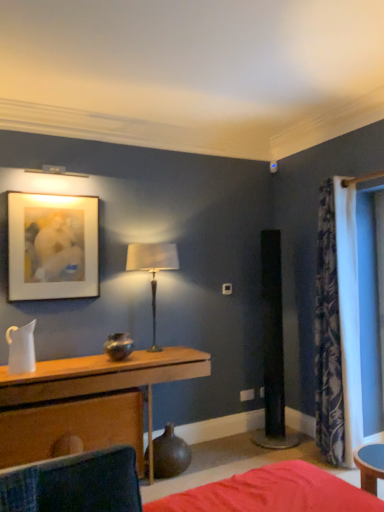
The width and height of the screenshot is (384, 512). Describe the element at coordinates (170, 454) in the screenshot. I see `matte brown vase at lower center` at that location.

Describe the element at coordinates (338, 322) in the screenshot. I see `floral fabric curtain at right` at that location.

What is the approximate height of metallic silver table lamp at center?

metallic silver table lamp at center is 91.65 centimeters tall.

The width and height of the screenshot is (384, 512). What do you see at coordinates (75, 484) in the screenshot?
I see `velvet dark green swivel chair at lower left` at bounding box center [75, 484].

Where is `velvet red bed at lower center`? The image size is (384, 512). velvet red bed at lower center is located at coordinates (272, 493).

How far apart are red fabric bed at lower center and metallic silver table lamp at center?

red fabric bed at lower center is 5.81 feet away from metallic silver table lamp at center.

Can you confirm if red fabric bed at lower center is taller than metallic silver table lamp at center?

No, red fabric bed at lower center is not taller than metallic silver table lamp at center.

Does red fabric bed at lower center turn towards metallic silver table lamp at center?

No, red fabric bed at lower center is not facing towards metallic silver table lamp at center.

Can you confirm if red fabric bed at lower center is thinner than metallic silver table lamp at center?

In fact, red fabric bed at lower center might be wider than metallic silver table lamp at center.

In the scene shown: Is velvet dark green swivel chair at lower left not within matte brown vase at lower center?

Yes, velvet dark green swivel chair at lower left is located beyond the bounds of matte brown vase at lower center.

From the image's perspective, does velvet dark green swivel chair at lower left appear higher than matte brown vase at lower center?

Correct, velvet dark green swivel chair at lower left appears higher than matte brown vase at lower center in the image.

Could you measure the distance between velvet dark green swivel chair at lower left and matte brown vase at lower center?

velvet dark green swivel chair at lower left and matte brown vase at lower center are 1.55 meters apart from each other.

Which object is positioned more to the right, velvet dark green swivel chair at lower left or matte brown vase at lower center?

Positioned to the right is matte brown vase at lower center.

Considering the sizes of objects wooden table at center and velvet dark green swivel chair at lower left in the image provided, who is bigger, wooden table at center or velvet dark green swivel chair at lower left?

wooden table at center.

Which is more to the right, wooden table at center or velvet dark green swivel chair at lower left?

Positioned to the right is velvet dark green swivel chair at lower left.

Is velvet dark green swivel chair at lower left at the back of wooden table at center?

wooden table at center is not turned away from velvet dark green swivel chair at lower left.

From a real-world perspective, is wooden table at center below velvet dark green swivel chair at lower left?

Yes, from a real-world perspective, wooden table at center is below velvet dark green swivel chair at lower left.

Is matte white picture frame at upper left wider than metallic silver table lamp at center?

No, matte white picture frame at upper left is not wider than metallic silver table lamp at center.

Where is `table lamp lying below the matte white picture frame at upper left (from the image's perspective)`? This screenshot has height=512, width=384. table lamp lying below the matte white picture frame at upper left (from the image's perspective) is located at coordinates (152, 269).

Visually, is matte white picture frame at upper left positioned to the left or to the right of metallic silver table lamp at center?

From the image, it's evident that matte white picture frame at upper left is to the left of metallic silver table lamp at center.

Looking at this image, is matte white picture frame at upper left turned away from metallic silver table lamp at center?

matte white picture frame at upper left does not have its back to metallic silver table lamp at center.

Could you tell me if velvet dark green swivel chair at lower left is turned towards wooden table at center?

No, velvet dark green swivel chair at lower left is not oriented towards wooden table at center.

Identify the location of table located below the velvet dark green swivel chair at lower left (from the image's perspective). The width and height of the screenshot is (384, 512). (104, 378).

From the picture: Does velvet dark green swivel chair at lower left appear on the left side of wooden table at center?

No, velvet dark green swivel chair at lower left is not to the left of wooden table at center.

Could wooden table at center be considered to be inside velvet dark green swivel chair at lower left?

Actually, wooden table at center is outside velvet dark green swivel chair at lower left.

Is velvet dark green swivel chair at lower left at the right side of matte white picture frame at upper left?

Yes.

Consider the image. Which is farther from the camera, (x=11, y=477) or (x=33, y=298)?

Point (x=33, y=298)

Considering the sizes of velvet dark green swivel chair at lower left and matte white picture frame at upper left in the image, is velvet dark green swivel chair at lower left taller or shorter than matte white picture frame at upper left?

Considering their sizes, velvet dark green swivel chair at lower left has less height than matte white picture frame at upper left.

Which object is further away from the camera, metallic silver table lamp at center or red fabric bed at lower center?

metallic silver table lamp at center is further away from the camera.

Does metallic silver table lamp at center have a greater height compared to red fabric bed at lower center?

Yes, metallic silver table lamp at center is taller than red fabric bed at lower center.

Are metallic silver table lamp at center and red fabric bed at lower center far apart?

metallic silver table lamp at center is positioned a significant distance from red fabric bed at lower center.

Where is `table lamp behind the red fabric bed at lower center`? The image size is (384, 512). table lamp behind the red fabric bed at lower center is located at coordinates pyautogui.click(x=152, y=269).

Where is `swivel chair located above the matte brown vase at lower center (from the image's perspective)`? swivel chair located above the matte brown vase at lower center (from the image's perspective) is located at coordinates (75, 484).

In the scene shown: From the image, which object appears to be nearer to velvet red bed at lower center, red fabric bed at lower center or metallic silver table lamp at center?

red fabric bed at lower center is closer to velvet red bed at lower center.

Looking at the image, which one is located further to velvet dark green swivel chair at lower left, metallic silver table lamp at center or matte brown vase at lower center?

Based on the image, metallic silver table lamp at center appears to be further to velvet dark green swivel chair at lower left.

Consider the image. Which object lies nearer to the anchor point velvet red bed at lower center, floral fabric curtain at right or velvet dark green swivel chair at lower left?

Among the two, velvet dark green swivel chair at lower left is located nearer to velvet red bed at lower center.

Which object lies further to the anchor point metallic silver table lamp at center, red fabric bed at lower center or velvet red bed at lower center?

Based on the image, red fabric bed at lower center appears to be further to metallic silver table lamp at center.

Which object lies nearer to the anchor point matte brown vase at lower center, floral fabric curtain at right or red fabric bed at lower center?

red fabric bed at lower center is positioned closer to the anchor matte brown vase at lower center.

Looking at the image, which one is located further to red fabric bed at lower center, wooden table at center or matte brown vase at lower center?

matte brown vase at lower center is further to red fabric bed at lower center.

Estimate the real-world distances between objects in this image. Which object is closer to metallic silver table lamp at center, wooden table at center or floral fabric curtain at right?

wooden table at center is closer to metallic silver table lamp at center.

Estimate the real-world distances between objects in this image. Which object is closer to matte white picture frame at upper left, matte brown vase at lower center or wooden table at center?

The object closer to matte white picture frame at upper left is wooden table at center.

The width and height of the screenshot is (384, 512). What are the coordinates of `vase between wooden table at center and floral fabric curtain at right in the horizontal direction` in the screenshot? It's located at (170, 454).

Find the location of a particular element. The height and width of the screenshot is (512, 384). swivel chair between matte white picture frame at upper left and red fabric bed at lower center from top to bottom is located at coordinates (75, 484).

Identify the location of bed frame that lies between matte white picture frame at upper left and red fabric bed at lower center from top to bottom. click(x=272, y=493).

You are a GUI agent. You are given a task and a screenshot of the screen. Output one action in this format:
    pyautogui.click(x=<x>, y=<y>)
    Task: Click on the swivel chair between velvet red bed at lower center and matte brown vase at lower center along the z-axis
    The width and height of the screenshot is (384, 512).
    Given the screenshot: What is the action you would take?
    pyautogui.click(x=75, y=484)